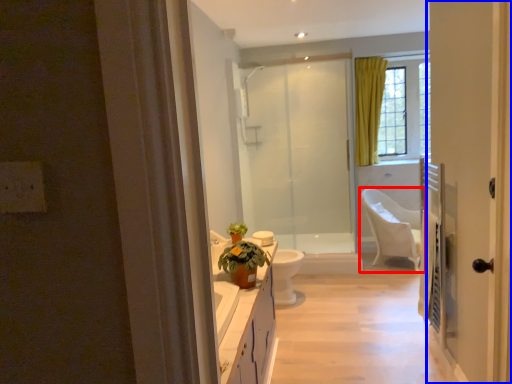
Question: Which point is further to the camera, chair (highlighted by a red box) or door (highlighted by a blue box)?

Choices:
 (A) chair
 (B) door

Answer: (A)